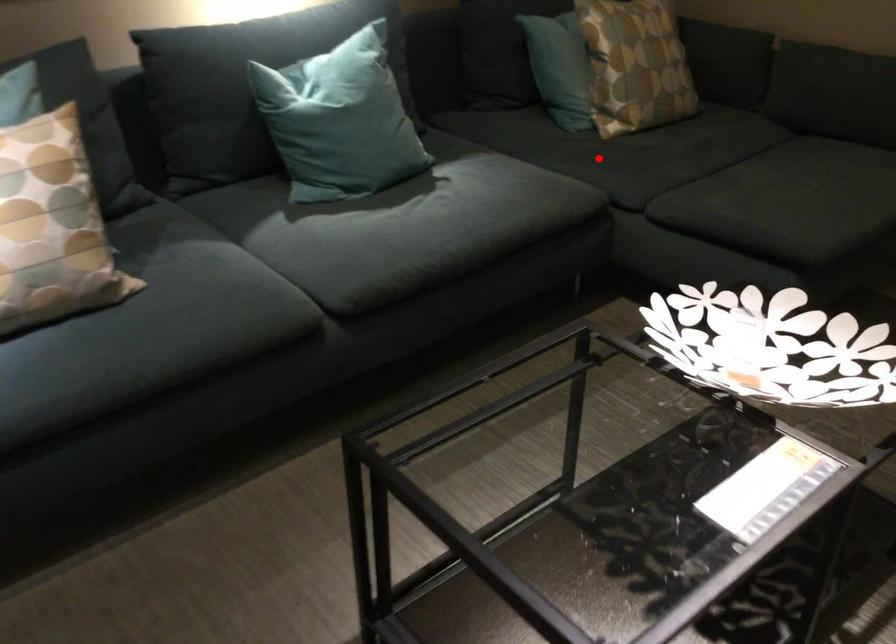
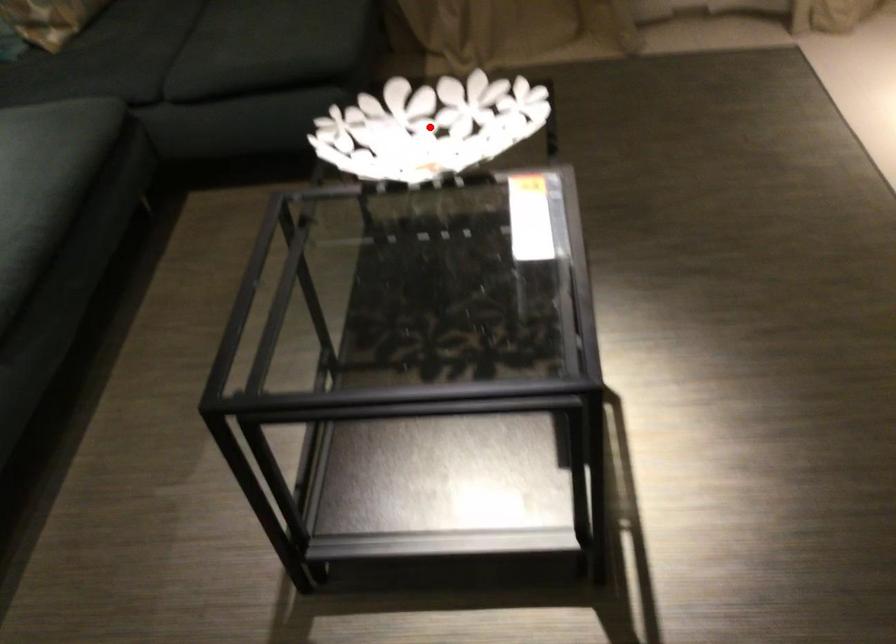
I am providing you with two images of the same scene from different viewpoints. A red point is marked on the first image and another point is marked on the second image. Is the marked point in image1 the same physical position as the marked point in image2?

No